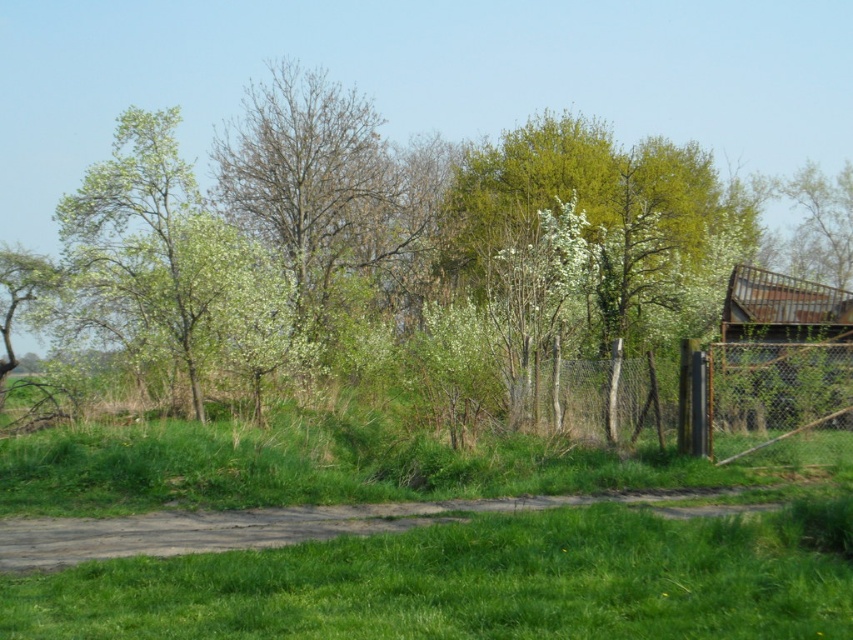
Is point (134, 260) farther from camera compared to point (814, 385)?

Yes, point (134, 260) is farther from viewer.

I want to click on green leafy tree at left, so click(x=169, y=253).

Based on the photo, does green leafy tree at center have a lesser width compared to green leafy tree at left?

In fact, green leafy tree at center might be wider than green leafy tree at left.

From the picture: Does green leafy tree at center appear under green leafy tree at left?

Actually, green leafy tree at center is above green leafy tree at left.

Who is more forward, (503, 300) or (136, 147)?

Point (503, 300) is in front.

Locate an element on the screen. green leafy tree at center is located at coordinates (422, 230).

Is green leafy tree at center below metallic chain-link fence at right?

Actually, green leafy tree at center is above metallic chain-link fence at right.

Is point (318, 104) positioned behind point (625, 380)?

Yes, point (318, 104) is behind point (625, 380).

Who is more distant from viewer, (231,216) or (537,385)?

The point (231,216) is more distant.

Where is `green leafy tree at center`? The height and width of the screenshot is (640, 853). green leafy tree at center is located at coordinates (422, 230).